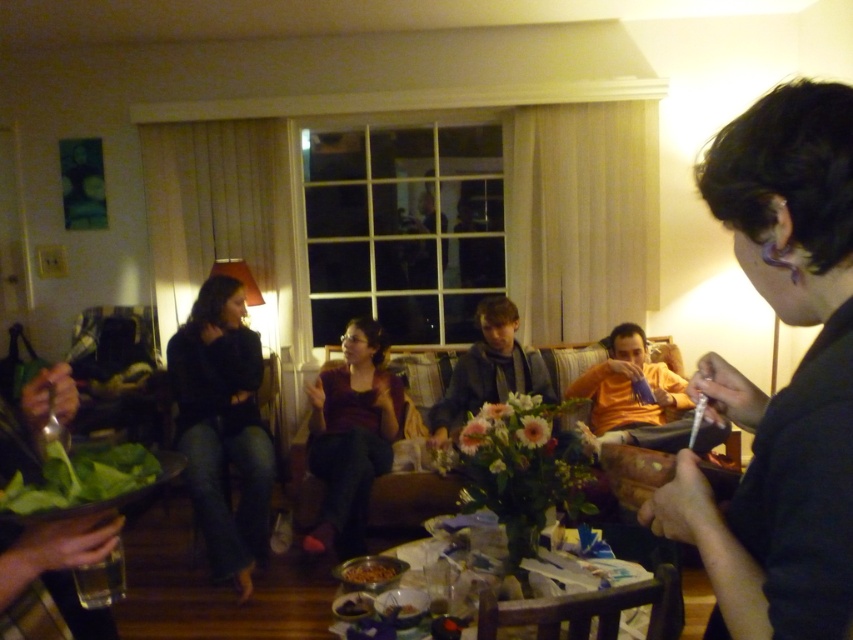
Between point (780, 518) and point (405, 602), which one is positioned in front?

Point (780, 518)

The height and width of the screenshot is (640, 853). What are the coordinates of `black fabric shirt at right` in the screenshot? It's located at (788, 380).

This screenshot has width=853, height=640. What do you see at coordinates (788, 380) in the screenshot? I see `black fabric shirt at right` at bounding box center [788, 380].

The image size is (853, 640). What are the coordinates of `black fabric shirt at right` in the screenshot? It's located at (788, 380).

Is black fabric shirt at right below matte purple sweater at center?

No, black fabric shirt at right is not below matte purple sweater at center.

What do you see at coordinates (788, 380) in the screenshot? This screenshot has height=640, width=853. I see `black fabric shirt at right` at bounding box center [788, 380].

Does point (763, 484) come closer to viewer compared to point (351, 529)?

Yes.

Locate an element on the screen. black fabric shirt at right is located at coordinates (788, 380).

Can you confirm if matte purple sweater at center is wider than green leafy vegetable at lower left?

Yes, matte purple sweater at center is wider than green leafy vegetable at lower left.

Who is more distant from viewer, (366, 346) or (62, 451)?

The point (366, 346) is behind.

Where is `matte purple sweater at center`? matte purple sweater at center is located at coordinates (351, 435).